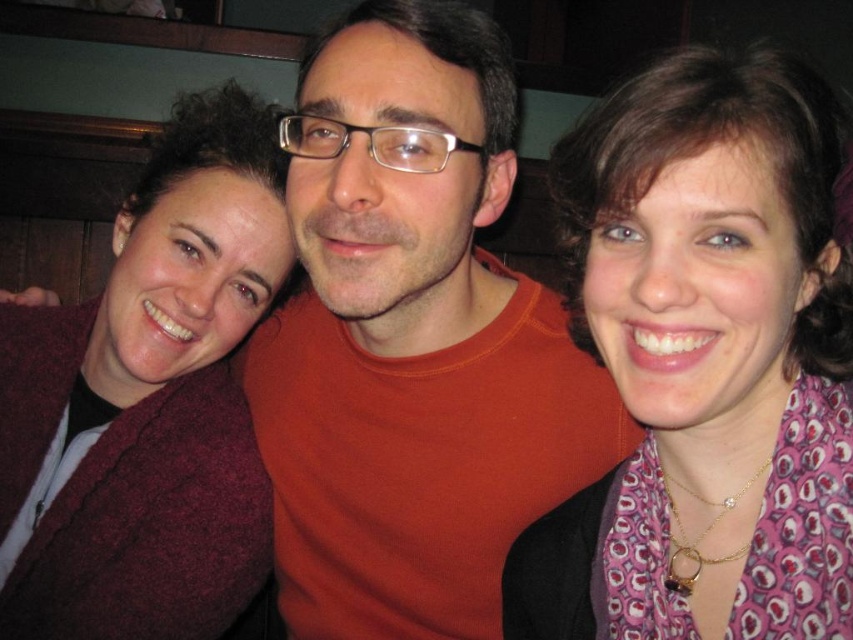
Does purple patterned scarf at center appear on the left side of maroon sweater at left?

In fact, purple patterned scarf at center is to the right of maroon sweater at left.

Between purple patterned scarf at center and maroon sweater at left, which one is positioned higher?

maroon sweater at left is above.

Does point (682, 408) come farther from viewer compared to point (212, 131)?

No, (682, 408) is in front of (212, 131).

The width and height of the screenshot is (853, 640). Find the location of `purple patterned scarf at center`. purple patterned scarf at center is located at coordinates (705, 364).

Which is in front, point (466, 580) or point (579, 630)?

Positioned in front is point (579, 630).

Is matte orange t-shirt at center closer to the viewer compared to purple patterned scarf at center?

No, it is not.

Is point (387, 19) positioned after point (606, 308)?

Yes, point (387, 19) is behind point (606, 308).

Identify the location of matte orange t-shirt at center. The image size is (853, 640). (412, 340).

Is point (335, 44) positioned after point (196, 276)?

That is False.

Between point (408, 444) and point (241, 262), which one is positioned behind?

Point (408, 444)

Measure the distance between matte orange t-shirt at center and camera.

matte orange t-shirt at center and camera are 26.36 inches apart from each other.

The width and height of the screenshot is (853, 640). In order to click on matte orange t-shirt at center in this screenshot , I will do `click(412, 340)`.